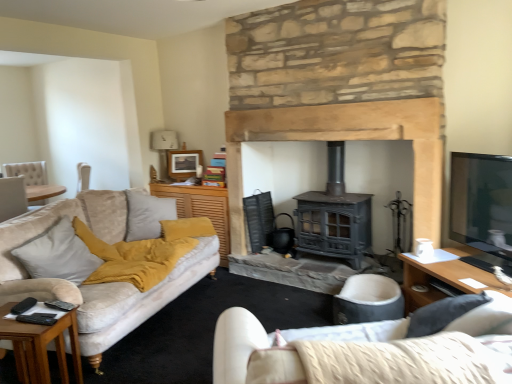
Find the location of `free location above matte black stove at center (from a real-world perspective)`. free location above matte black stove at center (from a real-world perspective) is located at coordinates (316, 105).